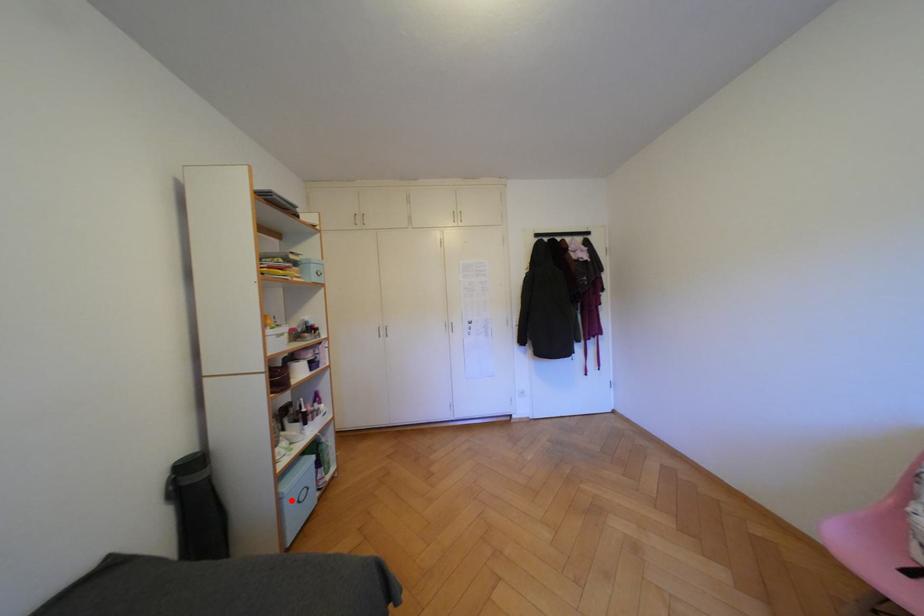
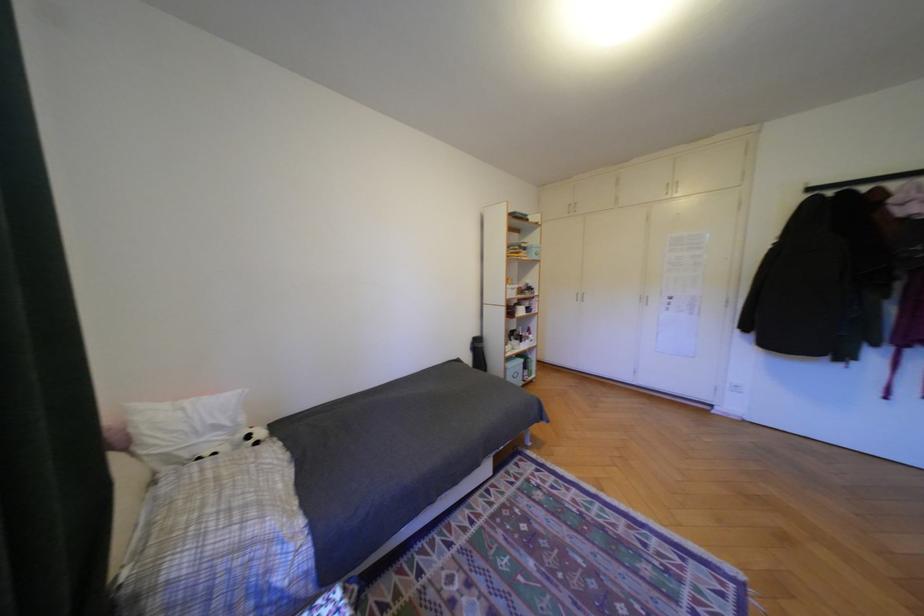
Question: I am providing you with two images of the same scene from different viewpoints. A red point is shown in image1. For the corresponding object point in image2, is it positioned nearer or farther from the camera?

Choices:
 (A) Nearer
 (B) Farther

Answer: (B)